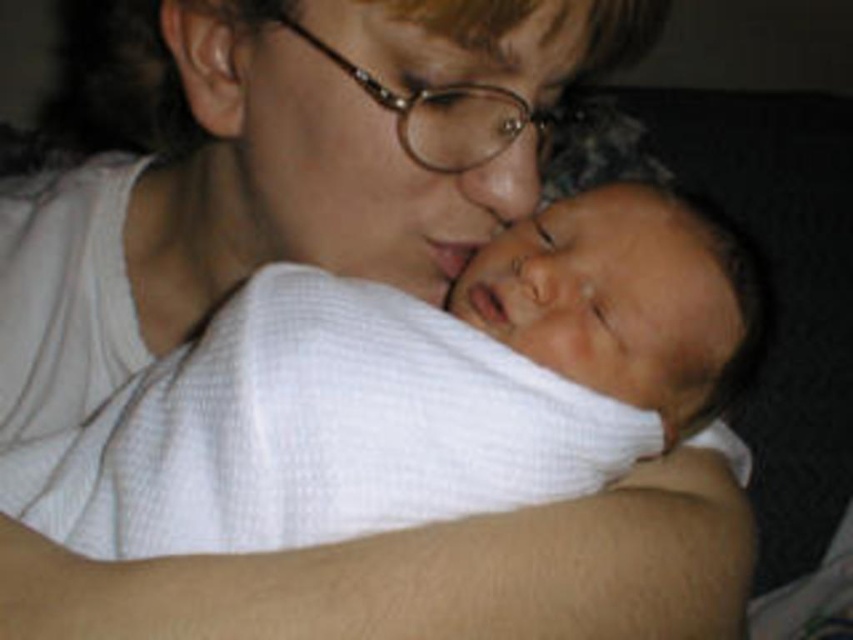
Is white cotton shirt at center behind soft beige arm at center?

Yes, white cotton shirt at center is further from the viewer.

Is point (277, 177) in front of point (422, 611)?

No.

Identify the location of white cotton shirt at center. The height and width of the screenshot is (640, 853). (292, 168).

Can you confirm if white cotton shirt at center is positioned below white textured cloth at center?

Actually, white cotton shirt at center is above white textured cloth at center.

Is white cotton shirt at center wider than white textured cloth at center?

Yes.

Where is `white cotton shirt at center`? white cotton shirt at center is located at coordinates (292, 168).

Find the location of a particular element. The width and height of the screenshot is (853, 640). white cotton shirt at center is located at coordinates (292, 168).

Is white textured cloth at center further to camera compared to soft beige arm at center?

Yes, it is.

Which is more to the right, white textured cloth at center or soft beige arm at center?

From the viewer's perspective, soft beige arm at center appears more on the right side.

Between point (135, 508) and point (171, 570), which one is positioned behind?

Positioned behind is point (135, 508).

Find the location of a particular element. white textured cloth at center is located at coordinates (401, 394).